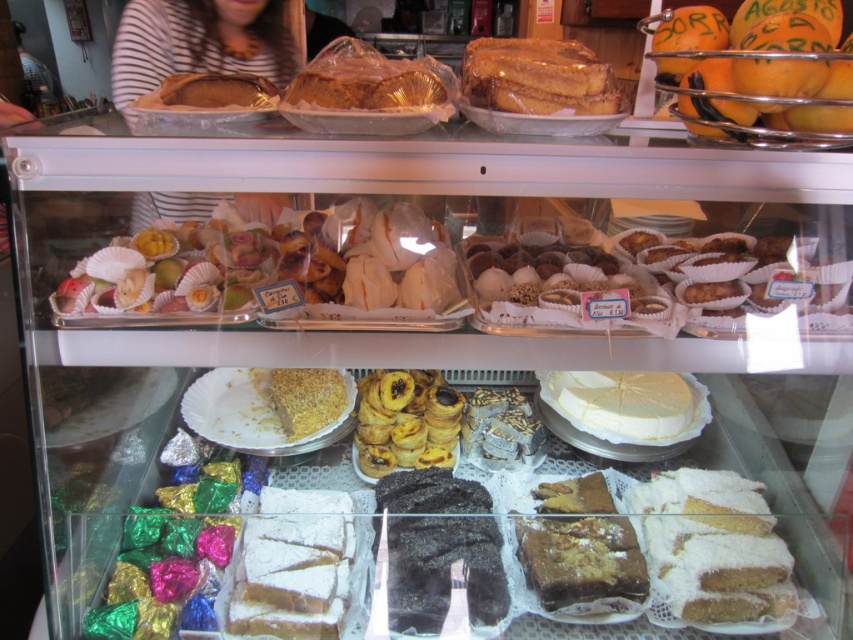
Question: Which object is positioned farthest from the powdered sugar cake at lower right?

Choices:
 (A) powdered sugar cake at center
 (B) shiny gold shells at center
 (C) striped fabric at upper left
 (D) orange citrus fruit at upper right

Answer: (C)

Question: Is shiny gold shells at center wider than golden flaky pastry at center?

Choices:
 (A) no
 (B) yes

Answer: (B)

Question: Does white cream cheese at center appear over golden crumbly cake at center?

Choices:
 (A) no
 (B) yes

Answer: (A)

Question: Does striped fabric at upper left have a greater width compared to white cream cheese at center?

Choices:
 (A) no
 (B) yes

Answer: (B)

Question: Which is nearer to the orange citrus fruit at upper right?

Choices:
 (A) powdered sugar cake at lower right
 (B) golden flaky pastry at center
 (C) powdered sugar cake at center

Answer: (A)

Question: Which of the following is the closest to the observer?

Choices:
 (A) golden flaky pastry at center
 (B) black matte cake at center
 (C) powdered white cake at center

Answer: (C)